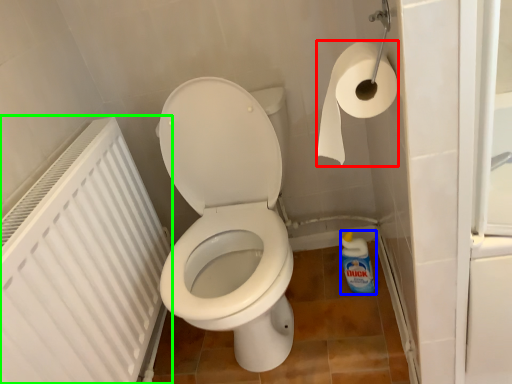
Question: Based on their relative distances, which object is farther from toilet paper (highlighted by a red box)? Choose from cleaning product (highlighted by a blue box) and radiator (highlighted by a green box).

Choices:
 (A) cleaning product
 (B) radiator

Answer: (A)